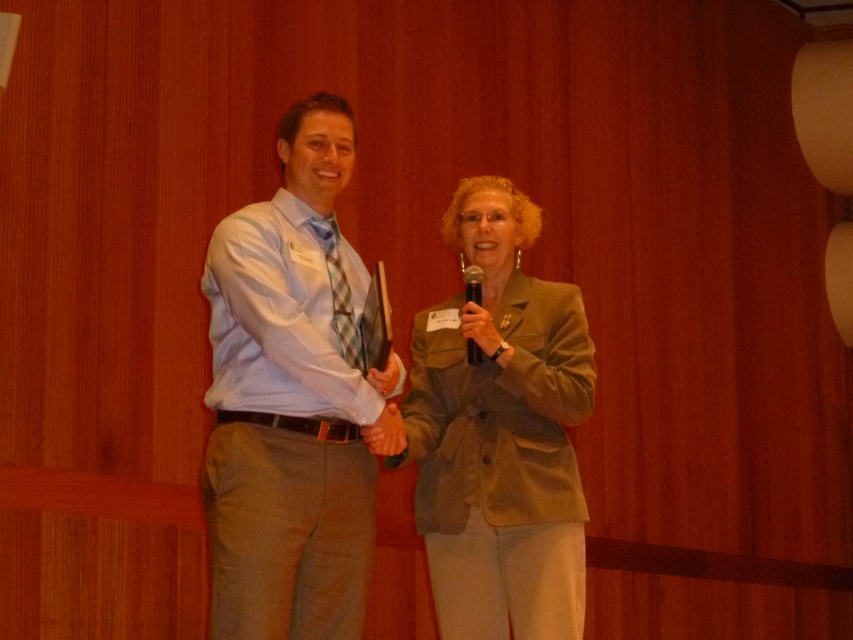
In the scene shown: Can you confirm if light blue shirt at center is shorter than black plastic microphone at center?

In fact, light blue shirt at center may be taller than black plastic microphone at center.

Can you confirm if light blue shirt at center is thinner than black plastic microphone at center?

Incorrect, light blue shirt at center's width is not less than black plastic microphone at center's.

The image size is (853, 640). In order to click on light blue shirt at center in this screenshot , I will do `click(292, 400)`.

Which is more to the right, light blue shirt at center or matte green blazer at center?

matte green blazer at center is more to the right.

Does point (318, 148) come closer to viewer compared to point (505, 384)?

Yes.

Identify the location of light blue shirt at center. (292, 400).

Image resolution: width=853 pixels, height=640 pixels. What are the coordinates of `light blue shirt at center` in the screenshot? It's located at (292, 400).

Between matte green blazer at center and black plastic microphone at center, which one is positioned lower?

matte green blazer at center is below.

Describe the element at coordinates (500, 433) in the screenshot. I see `matte green blazer at center` at that location.

Is point (466, 208) positioned after point (480, 275)?

Yes.

Where is `matte green blazer at center`? The width and height of the screenshot is (853, 640). matte green blazer at center is located at coordinates (500, 433).